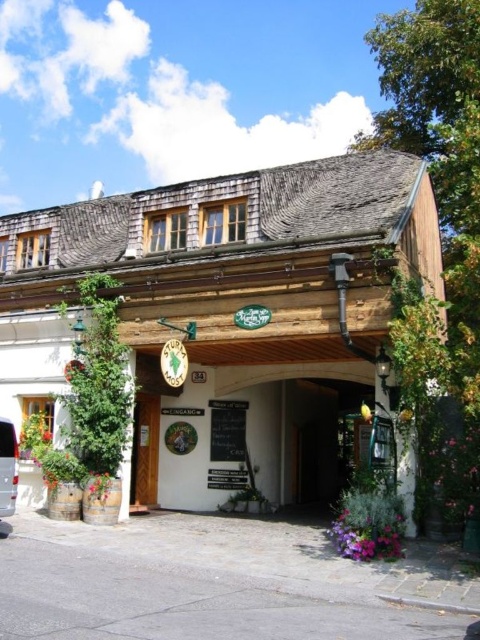
Question: Which is nearer to the silver metallic van at lower left?

Choices:
 (A) white wood building at center
 (B) wooden door at center

Answer: (B)

Question: Does wooden door at center have a greater width compared to silver metallic van at lower left?

Choices:
 (A) no
 (B) yes

Answer: (B)

Question: Among these objects, which one is farthest from the camera?

Choices:
 (A) white wood building at center
 (B) silver metallic van at lower left

Answer: (A)

Question: Based on their relative distances, which object is nearer to the white wood building at center?

Choices:
 (A) silver metallic van at lower left
 (B) wooden door at center

Answer: (B)

Question: Does white wood building at center come in front of wooden door at center?

Choices:
 (A) no
 (B) yes

Answer: (B)

Question: Does wooden door at center lie in front of silver metallic van at lower left?

Choices:
 (A) yes
 (B) no

Answer: (B)